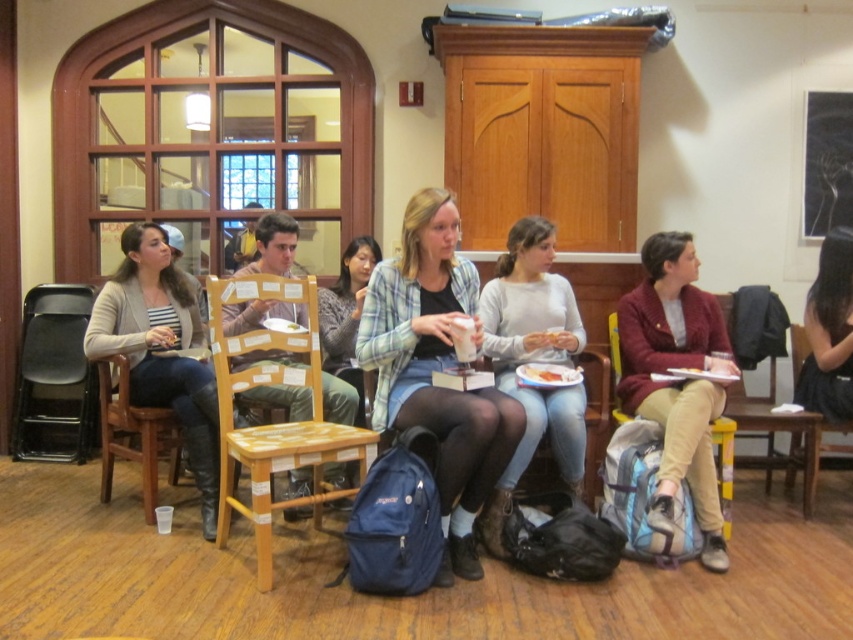
You are organizing a small event and need to arrange chairs for attendees. You have two wooden chairs available. The wooden chair at center and the wooden chair at left. Which chair would be more suitable for a guest who requires a wider seat to accommodate their mobility aid?

The wooden chair at left would be more suitable because it has a greater width than the wooden chair at center, providing more space for the guest.

You are a service robot with a 1.5 meter long tray. You need to move from the matte gray sweater at left to the white paper plate at center. Can your tray fit between them without bending?

The distance between the matte gray sweater at left and the white paper plate at center is 1.62 meters. Since your tray is 1.5 meters long, it can fit between them without bending.